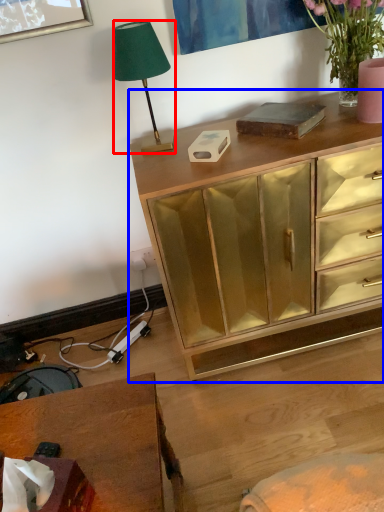
Question: Which point is closer to the camera, lamp (highlighted by a red box) or chest of drawers (highlighted by a blue box)?

Choices:
 (A) lamp
 (B) chest of drawers

Answer: (B)